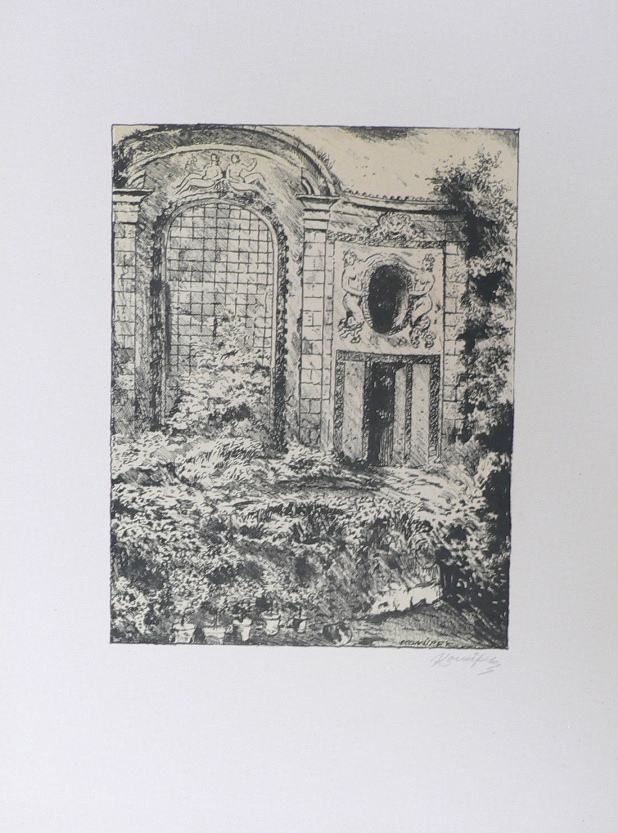
At what (x,y) coordinates should I click in order to perform the action: click on doorway. Please return your answer as a coordinate pair (x, y). This screenshot has height=833, width=618. Looking at the image, I should click on (384, 413).